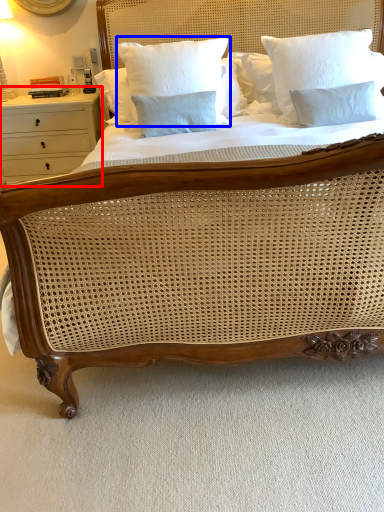
Question: Which point is further to the camera, nightstand (highlighted by a red box) or pillow (highlighted by a blue box)?

Choices:
 (A) nightstand
 (B) pillow

Answer: (A)